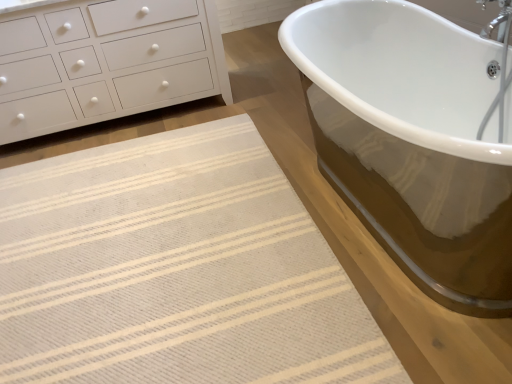
Question: In the image, is white matte chest of drawers at upper left positioned in front of or behind beige woven rug at lower left?

Choices:
 (A) behind
 (B) front

Answer: (A)

Question: Based on their sizes in the image, would you say white matte chest of drawers at upper left is bigger or smaller than beige woven rug at lower left?

Choices:
 (A) small
 (B) big

Answer: (B)

Question: Is point (182, 14) positioned closer to the camera than point (117, 200)?

Choices:
 (A) closer
 (B) farther

Answer: (B)

Question: Considering the positions of beige woven rug at lower left and white matte chest of drawers at upper left in the image, is beige woven rug at lower left taller or shorter than white matte chest of drawers at upper left?

Choices:
 (A) short
 (B) tall

Answer: (A)

Question: Is beige woven rug at lower left spatially inside white matte chest of drawers at upper left, or outside of it?

Choices:
 (A) outside
 (B) inside

Answer: (A)

Question: Based on their positions, is beige woven rug at lower left located to the left or right of white matte chest of drawers at upper left?

Choices:
 (A) right
 (B) left

Answer: (A)

Question: From a real-world perspective, is beige woven rug at lower left positioned above or below white matte chest of drawers at upper left?

Choices:
 (A) above
 (B) below

Answer: (B)